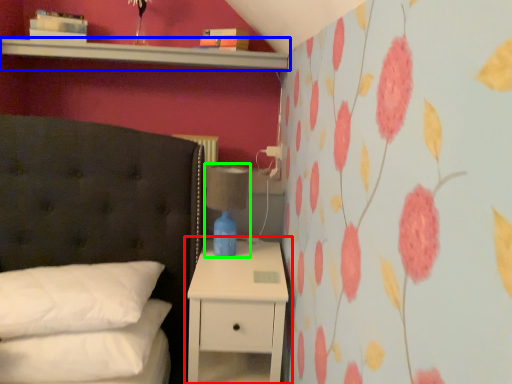
Question: Which object is the farthest from nightstand (highlighted by a red box)? Choose among these: shelf (highlighted by a blue box) or bedside lamp (highlighted by a green box).

Choices:
 (A) shelf
 (B) bedside lamp

Answer: (A)